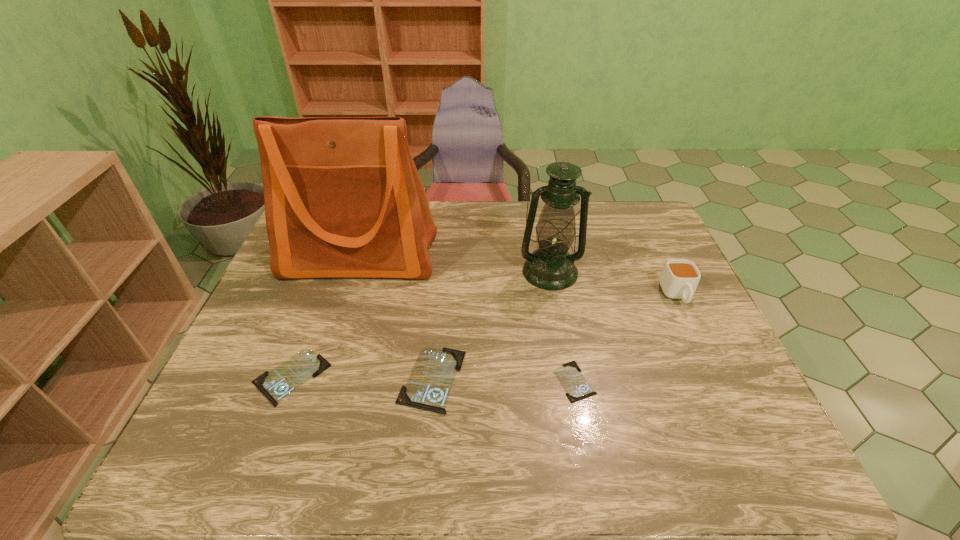
I want to click on object situated at the near left corner, so click(x=275, y=385).

Where is `free space at the far edge of the desktop`? Image resolution: width=960 pixels, height=540 pixels. free space at the far edge of the desktop is located at coordinates (517, 201).

This screenshot has height=540, width=960. In the image, there is a desktop. Find the location of `free space at the right edge`. free space at the right edge is located at coordinates (688, 340).

The height and width of the screenshot is (540, 960). In order to click on vacant region at the far right corner of the desktop in this screenshot , I will do `click(629, 201)`.

This screenshot has height=540, width=960. In the image, there is a desktop. In order to click on vacant space at the near right corner in this screenshot , I will do `click(728, 400)`.

This screenshot has width=960, height=540. In order to click on vacant area that lies between the second identity card from right to left and the fourth shortest object in this screenshot , I will do `click(555, 338)`.

Find the location of `vacant area that lies between the rightmost object and the rightmost identity card`. vacant area that lies between the rightmost object and the rightmost identity card is located at coordinates (626, 339).

Where is `vacant point located between the second identity card from left to right and the second tallest identity card`? vacant point located between the second identity card from left to right and the second tallest identity card is located at coordinates (362, 378).

Identify the location of vacant space in between the second identity card from left to right and the oil lamp. The height and width of the screenshot is (540, 960). (492, 325).

Find the location of `free area in between the second tallest object and the shortest identity card`. free area in between the second tallest object and the shortest identity card is located at coordinates (563, 327).